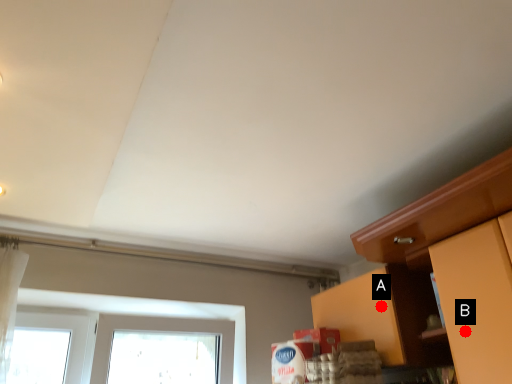
Question: Two points are circled on the image, labeled by A and B beside each circle. Which point is farther from the camera taking this photo?

Choices:
 (A) A is further
 (B) B is further

Answer: (A)